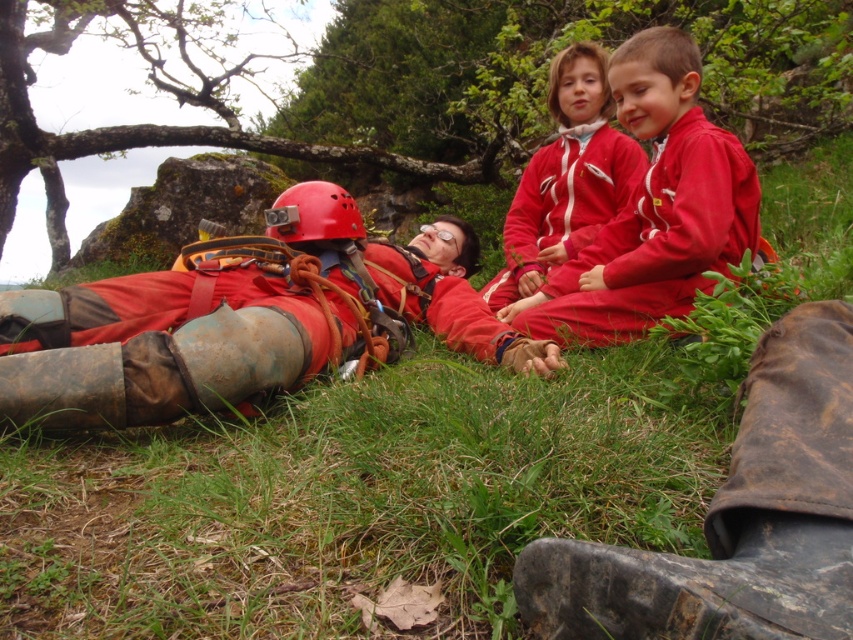
Based on the coordinates provided in the scene, where is the matte red tracksuit at center located?

The matte red tracksuit at center is located at the coordinates point [654,208].